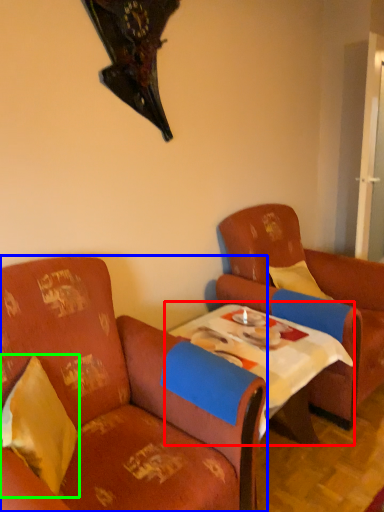
Question: Estimate the real-world distances between objects in this image. Which object is farther from table (highlighted by a red box), chair (highlighted by a blue box) or pillow (highlighted by a green box)?

Choices:
 (A) chair
 (B) pillow

Answer: (B)